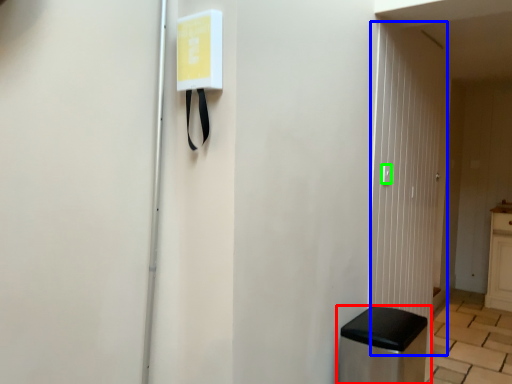
Question: Estimate the real-world distances between objects in this image. Which object is farther from furniture (highlighted by a red box), glass door (highlighted by a blue box) or light switch (highlighted by a green box)?

Choices:
 (A) glass door
 (B) light switch

Answer: (B)